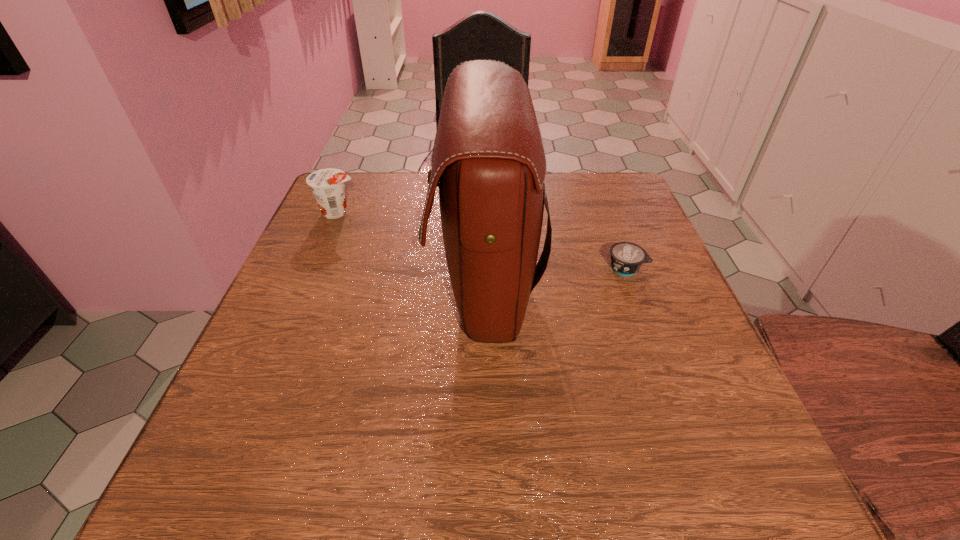
Image resolution: width=960 pixels, height=540 pixels. I want to click on vacant space located on the left of the right yogurt, so click(x=441, y=268).

This screenshot has height=540, width=960. Find the location of `object situated at the far edge`. object situated at the far edge is located at coordinates 327,185.

Image resolution: width=960 pixels, height=540 pixels. I want to click on object located in the left edge section of the desktop, so click(327, 185).

Identify the location of object positioned at the right edge. The image size is (960, 540). (626, 258).

Image resolution: width=960 pixels, height=540 pixels. Find the location of `object present at the far left corner`. object present at the far left corner is located at coordinates (327, 185).

Find the location of `free location at the far edge`. free location at the far edge is located at coordinates (410, 199).

In order to click on vacant area at the near edge of the desktop in this screenshot , I will do `click(385, 488)`.

In the image, there is a desktop. Where is `vacant space at the left edge`? The width and height of the screenshot is (960, 540). vacant space at the left edge is located at coordinates (319, 268).

Identify the location of free space at the right edge. (685, 362).

You are a GUI agent. You are given a task and a screenshot of the screen. Output one action in this format:
    pyautogui.click(x=<x>, y=<y>)
    Task: Click on the vacant space at the far left corner of the desktop
    
    Given the screenshot: What is the action you would take?
    pyautogui.click(x=349, y=217)